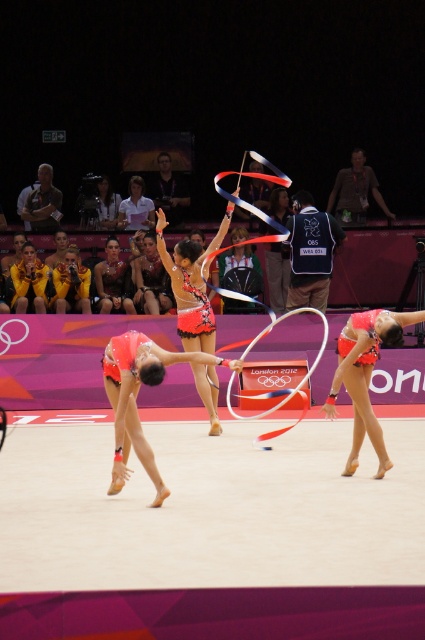
You are a photographer positioned at the origin point of the coordinate system in the image. You want to capture a closeup shot of the matte orange leotard at center. Given that your camera can focus on objects within a 0.5 unit radius from your current position, can you achieve this without moving?

The matte orange leotard at center is located at point [136,397]. The distance from the origin to this point is sqrt0.622 squared plus 0.320 squared equals approximately 0.70 units. Since this exceeds the camera0.5 unit focus range, you cannot capture the closeup without moving closer.

You are a photographer at the London 2012 Olympics. You need to capture a photo where the shiny silver gymnastics outfit at center and the matte gold jacket at left are both visible. Based on their heights, which gymnast should you position closer to the camera to ensure both are fully visible in the frame?

The shiny silver gymnastics outfit at center is much taller than the matte gold jacket at left. To ensure both are fully visible, position the matte gold jacket at left closer to the camera so its shorter height doesn

You are a photographer at the London 2012 Olympics. You need to capture a closeup shot of both the shiny silver gymnastics outfit at center and the matte gold jacket at left. Given that your camera can only focus on one object at a time, which object should you focus on first to ensure the larger one is in focus?

The shiny silver gymnastics outfit at center is bigger than the matte gold jacket at left, so you should focus on the shiny silver gymnastics outfit at center first to ensure the larger object is in focus.